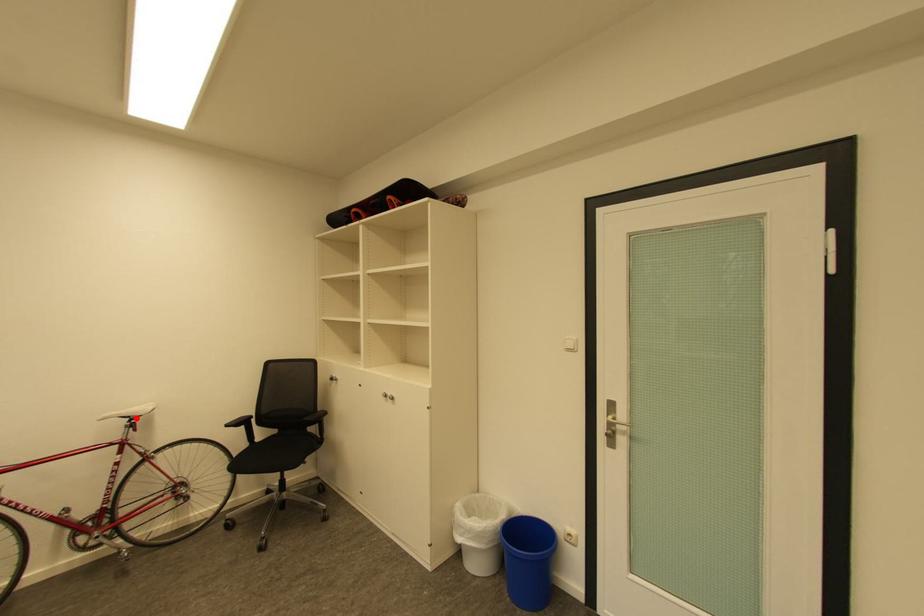
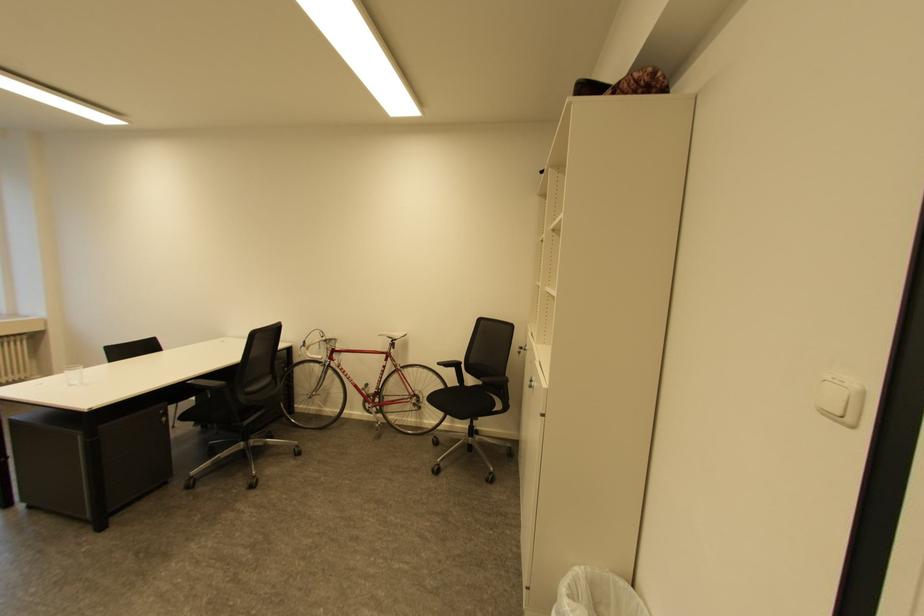
Question: I am providing you with two images of the same scene from different viewpoints. Image1 has a red point marked. In image2, the corresponding 3D location appears at what relative position? Reply with the corresponding letter.

Choices:
 (A) Closer
 (B) Farther

Answer: (B)